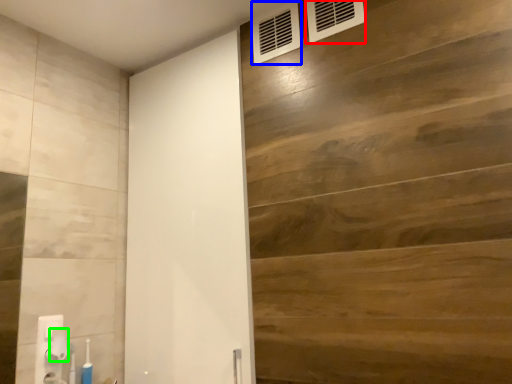
Question: Considering the real-world distances, which object is closest to air conditioning (highlighted by a red box)? air conditioning (highlighted by a blue box) or towel bar (highlighted by a green box).

Choices:
 (A) air conditioning
 (B) towel bar

Answer: (A)